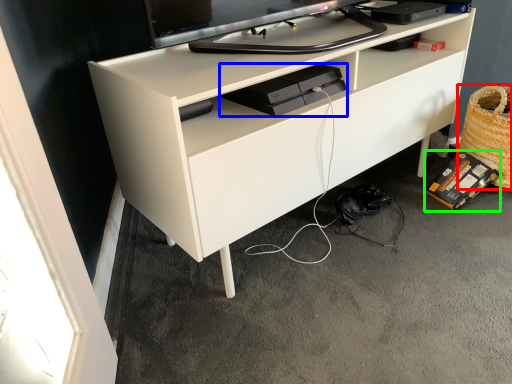
Question: Which object is positioned closest to basket (highlighted by a red box)? Select from equipment (highlighted by a blue box) and equipment (highlighted by a green box).

Choices:
 (A) equipment
 (B) equipment

Answer: (B)